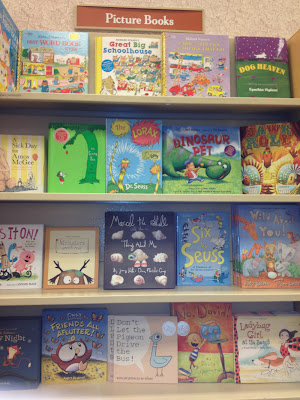
In order to click on shelf backboard in this screenshot , I will do `click(135, 308)`, `click(93, 216)`, `click(41, 118)`.